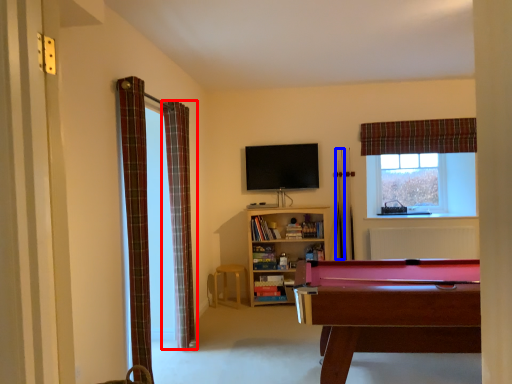
Question: Which of the following is the closest to the observer, curtain (highlighted by a red box) or cue (highlighted by a blue box)?

Choices:
 (A) curtain
 (B) cue

Answer: (A)